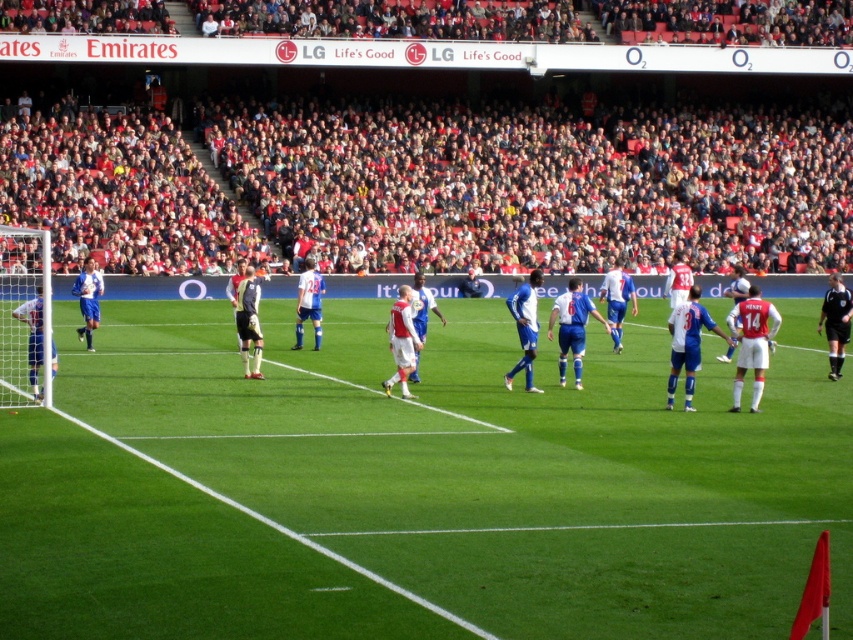
You are a soccer player preparing to kick the ball. You notice the green grass field at center and the blue fabric shorts at center. Which object is lower in height?

The green grass field at center is shorter than the blue fabric shorts at center, so the green grass field at center is lower in height.

You are a photographer standing at the edge of the soccer field. You want to take a photo that includes both the green grass field at center and the blue fabric shorts at center. Which object will appear larger in your photo?

The green grass field at center will appear larger in the photo because it is closer to the viewer than the blue fabric shorts at center.